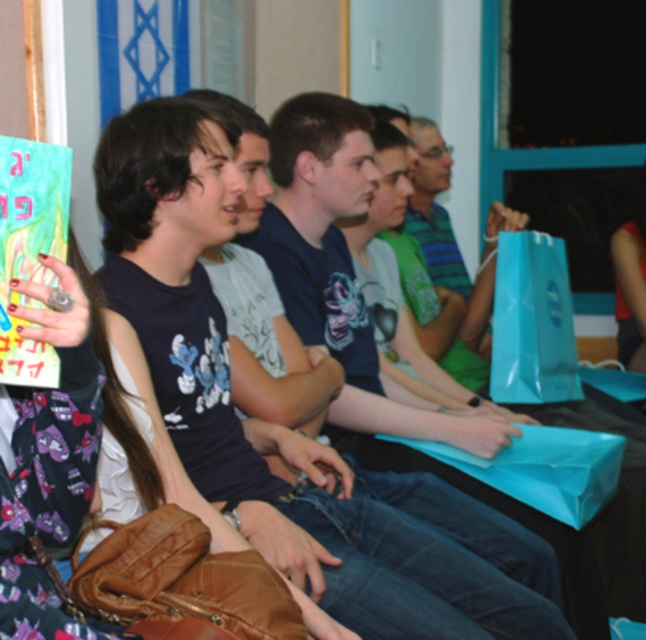
Is point (171, 404) positioned after point (494, 385)?

No.

Between dark blue t-shirt at center and blue paper bag at center, which one appears on the left side from the viewer's perspective?

dark blue t-shirt at center

Is point (424, 544) closer to camera compared to point (539, 291)?

Yes, it is in front of point (539, 291).

Locate an element on the screen. The height and width of the screenshot is (640, 646). dark blue t-shirt at center is located at coordinates (284, 426).